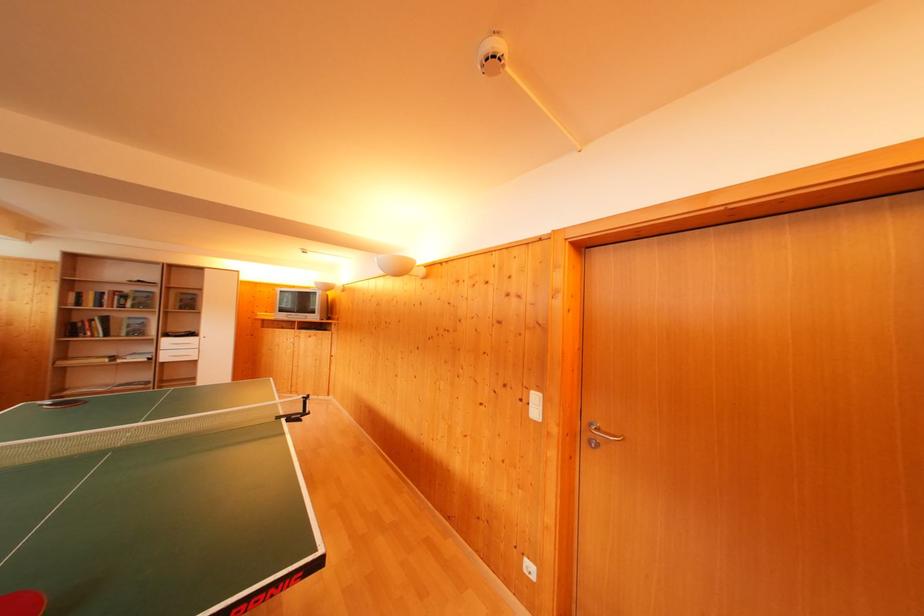
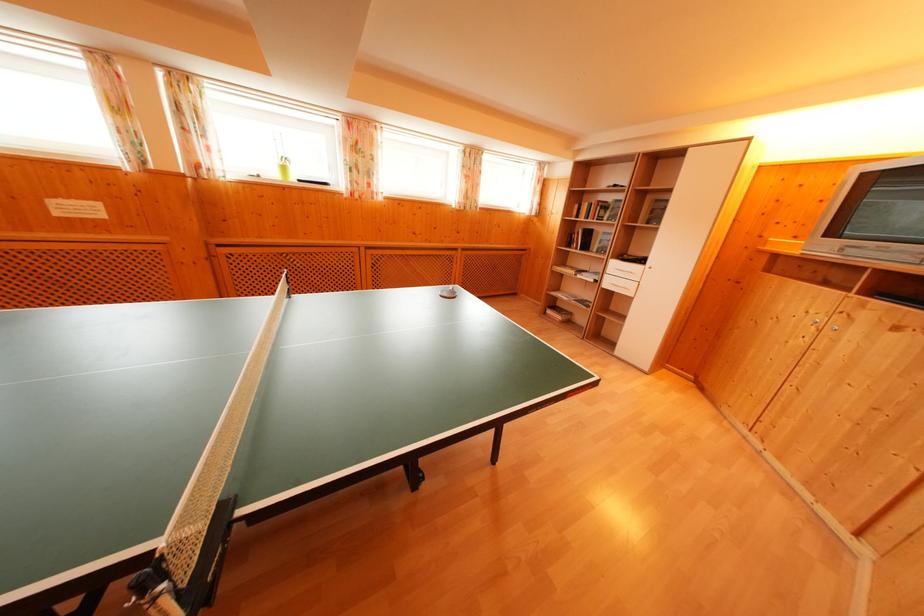
Where in the second image is the point corresponding to point (78, 300) from the first image?

(581, 211)